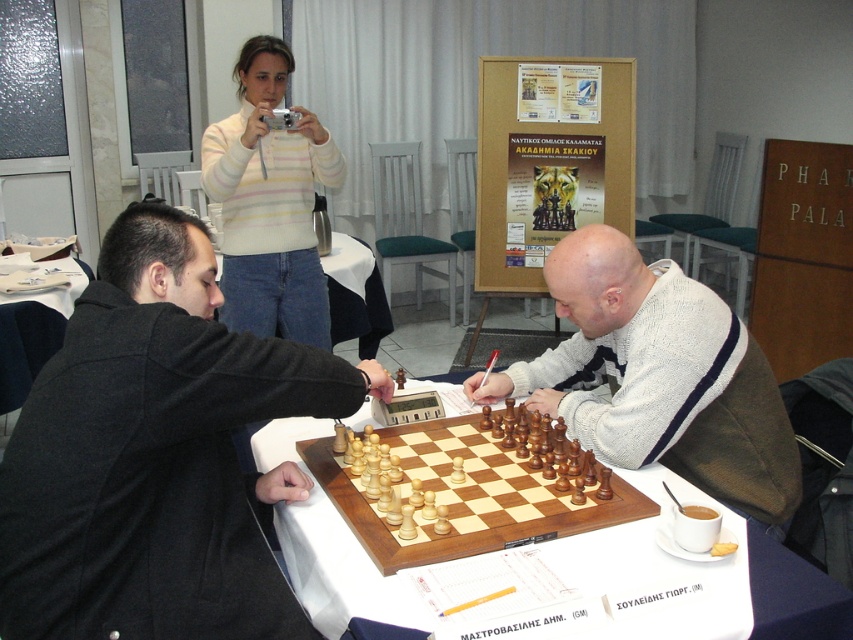
You are a photographer standing in front of the chessboard. You want to take a photo of the striped sweater at upper center without the wooden chessboard at center blocking the view. Is this possible?

The wooden chessboard at center is in front of the striped sweater at upper center, so it will block the view. Move the camera position to the side so that the wooden chessboard at center is no longer between you and the striped sweater at upper center.

You are organizing a chess tournament and need to ensure that all chess sets and boards fit on a standard 1.2 meter long table. Given that the wooden chess set at center is larger than the light brown wooden chessboard at center, will both items fit on the table if placed side by side?

The wooden chess set at center is larger in size than the light brown wooden chessboard at center. However, without specific measurements, it is impossible to determine if their combined length will exceed the 1.2 meter table. Additional information about their individual dimensions is required to confirm.